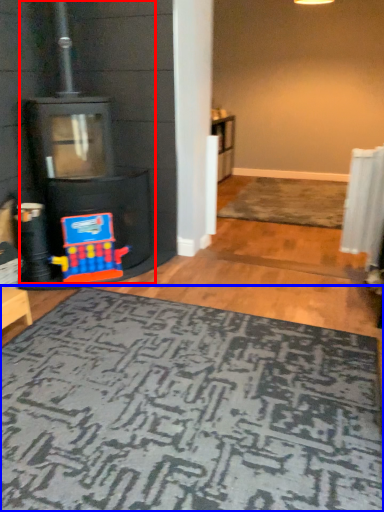
Question: Which object appears farthest to the camera in this image, fireplace (highlighted by a red box) or mat (highlighted by a blue box)?

Choices:
 (A) fireplace
 (B) mat

Answer: (A)